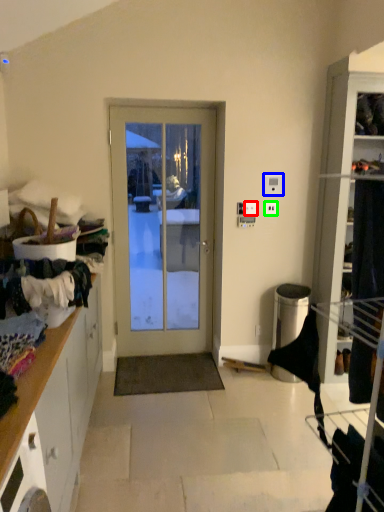
Question: Estimate the real-world distances between objects in this image. Which object is closer to light switch (highlighted by a red box), light switch (highlighted by a blue box) or electric outlet (highlighted by a green box)?

Choices:
 (A) light switch
 (B) electric outlet

Answer: (B)